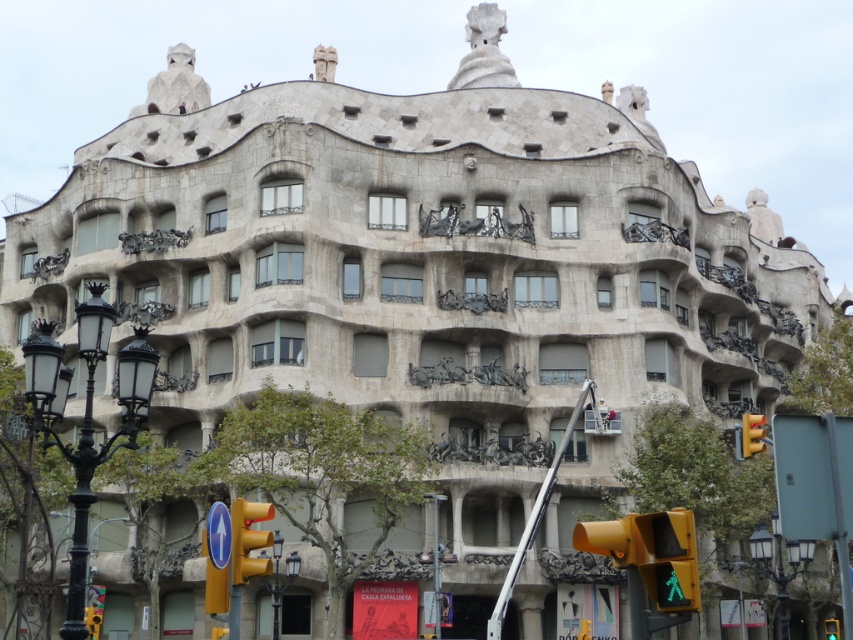
You are a pedestrian standing in front of Casa Mila and want to cross the street. You see a yellow matte pedestrian signal at lower right and a yellow plastic traffic light at lower left. Which one should you look at to determine if it is safe to cross?

You should look at the yellow matte pedestrian signal at lower right because it is specifically designed for pedestrians and indicates when it is safe to cross.

You are standing in front of Casa Mila and want to take a photo that includes both the traffic light and the building. The traffic light is at point (235, 579) and the building is at point (756, 436). Which point should you focus on to ensure both are in focus?

You should focus on point (756, 436) because it is farther away, ensuring the closer point (235, 579) will also be in focus due to depth of field.